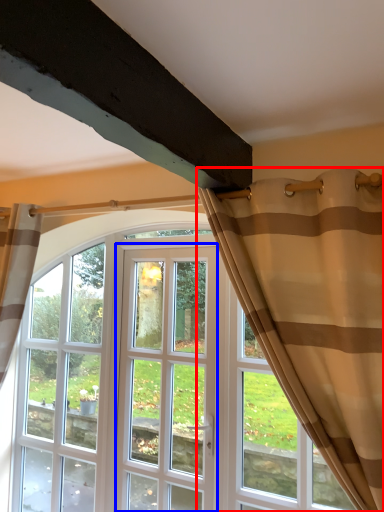
Question: Which of the following is the farthest to the observer, curtain (highlighted by a red box) or screen door (highlighted by a blue box)?

Choices:
 (A) curtain
 (B) screen door

Answer: (B)